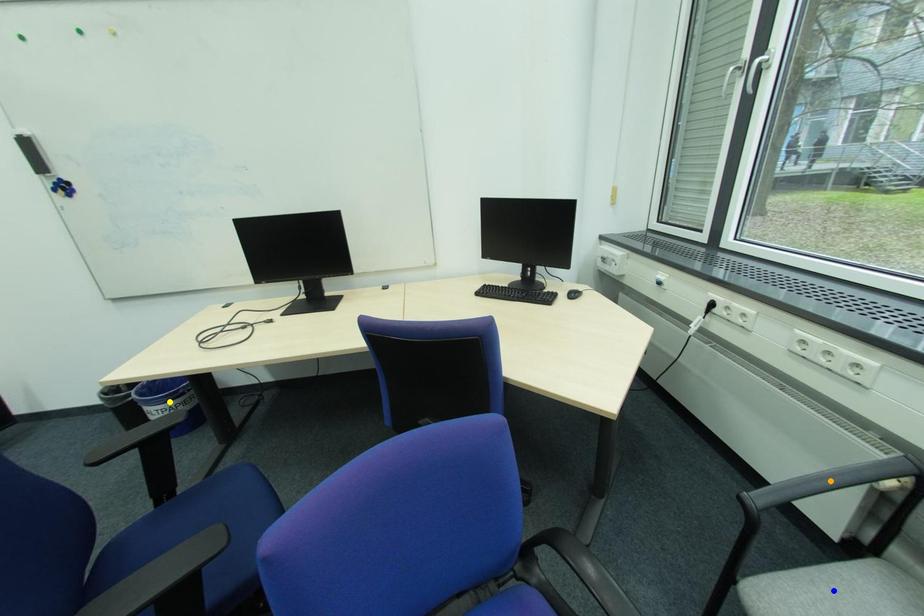
Order these from nearest to farthest:
A) yellow point
B) orange point
C) blue point

1. blue point
2. orange point
3. yellow point